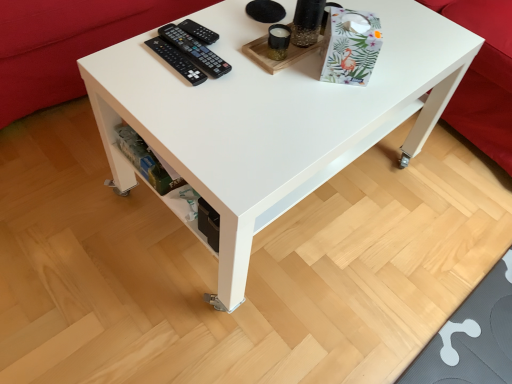
You are a GUI agent. You are given a task and a screenshot of the screen. Output one action in this format:
    pyautogui.click(x=<x>, y=<y>)
    Task: Click on the free space in front of white glossy table at center
    The width and height of the screenshot is (512, 384).
    Given the screenshot: What is the action you would take?
    pyautogui.click(x=254, y=318)